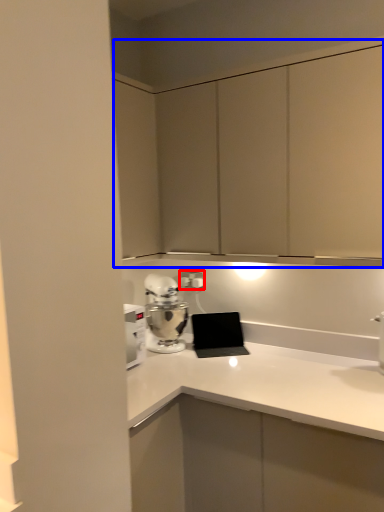
Question: Which of the following is the closest to the observer, electric outlet (highlighted by a red box) or dresser (highlighted by a blue box)?

Choices:
 (A) electric outlet
 (B) dresser

Answer: (B)